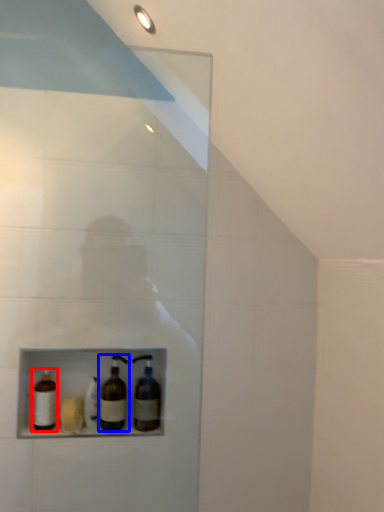
Question: Which object is closer to the camera taking this photo, bottle (highlighted by a red box) or bottle (highlighted by a blue box)?

Choices:
 (A) bottle
 (B) bottle

Answer: (A)